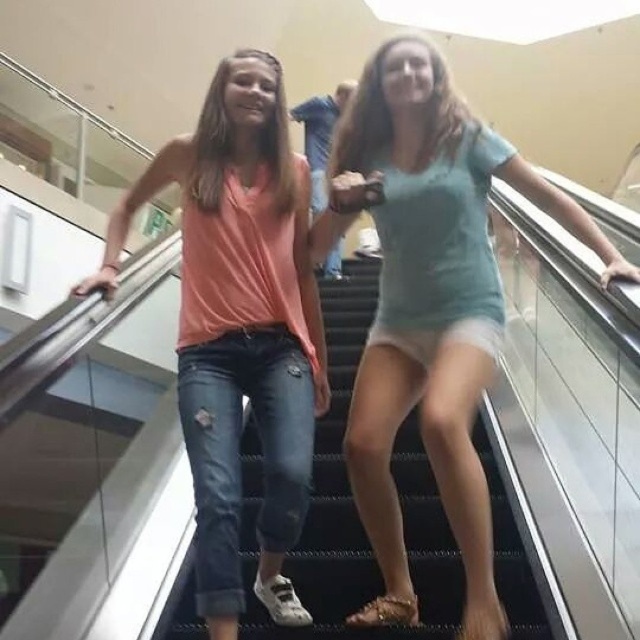
Is light blue fabric shorts at center smaller than matte orange shirt at center?

No, light blue fabric shorts at center is not smaller than matte orange shirt at center.

Is point (428, 204) positioned in front of point (216, 172)?

Yes, point (428, 204) is closer to viewer.

Is point (362, 132) behind point (221, 120)?

Yes, it is.

Identify the location of light blue fabric shorts at center. (429, 305).

Is point (218, 620) closer to viewer compared to point (372, 632)?

That is True.

Which of these two, matte orange shirt at center or denim at center, stands taller?

Standing taller between the two is matte orange shirt at center.

Does point (230, 381) come closer to viewer compared to point (252, 516)?

Yes, it is.

This screenshot has width=640, height=640. Identify the location of matte orange shirt at center. (241, 324).

Between light blue fabric shorts at center and denim at center, which one has less height?

With less height is denim at center.

Does light blue fabric shorts at center come in front of denim at center?

Yes.

The image size is (640, 640). Describe the element at coordinates (429, 305) in the screenshot. I see `light blue fabric shorts at center` at that location.

Identify the location of light blue fabric shorts at center. This screenshot has height=640, width=640. (429, 305).